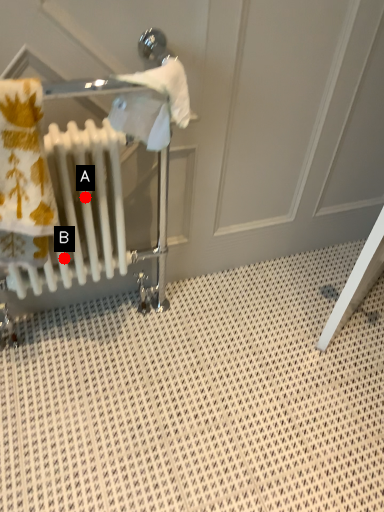
Question: Two points are circled on the image, labeled by A and B beside each circle. Which point is farther to the camera?

Choices:
 (A) A is further
 (B) B is further

Answer: (B)